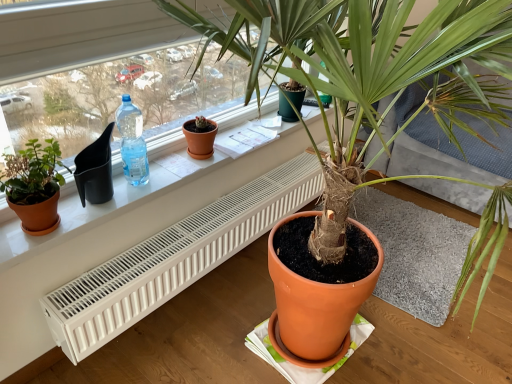
Question: Is the surface of matte terracotta pot at left, placed as the 2th houseplant when sorted from front to back, in direct contact with translucent plastic bottle at window left?

Choices:
 (A) yes
 (B) no

Answer: (B)

Question: From a real-world perspective, does matte terracotta pot at left, the first houseplant in the back-to-front sequence, stand above translucent plastic bottle at window left?

Choices:
 (A) yes
 (B) no

Answer: (B)

Question: Can you confirm if matte terracotta pot at left, placed as the 2th houseplant when sorted from front to back, is bigger than translucent plastic bottle at window left?

Choices:
 (A) no
 (B) yes

Answer: (B)

Question: From a real-world perspective, is matte terracotta pot at left, placed as the 2th houseplant when sorted from front to back, beneath translucent plastic bottle at window left?

Choices:
 (A) yes
 (B) no

Answer: (A)

Question: Would you say matte terracotta pot at left, which is the 2th houseplant in right-to-left order, contains translucent plastic bottle at window left?

Choices:
 (A) yes
 (B) no

Answer: (B)

Question: Can you confirm if matte terracotta pot at left, placed as the 2th houseplant when sorted from front to back, is taller than translucent plastic bottle at window left?

Choices:
 (A) yes
 (B) no

Answer: (B)

Question: Is white plastic radiator at lower center at the back of matte orange pot at center, the 2th houseplant when ordered from left to right?

Choices:
 (A) no
 (B) yes

Answer: (B)

Question: Does matte orange pot at center, marked as the 2th houseplant in a back-to-front arrangement, lie behind white plastic radiator at lower center?

Choices:
 (A) yes
 (B) no

Answer: (B)

Question: Can you see matte orange pot at center, which is the first houseplant in right-to-left order, touching white plastic radiator at lower center?

Choices:
 (A) no
 (B) yes

Answer: (A)

Question: From the image's perspective, is matte orange pot at center, marked as the 2th houseplant in a back-to-front arrangement, on top of white plastic radiator at lower center?

Choices:
 (A) no
 (B) yes

Answer: (B)

Question: Is matte orange pot at center, the 1th houseplant when ordered from front to back, to the right of white plastic radiator at lower center from the viewer's perspective?

Choices:
 (A) no
 (B) yes

Answer: (B)

Question: Does matte orange pot at center, the 2th houseplant when ordered from left to right, have a larger size compared to white plastic radiator at lower center?

Choices:
 (A) yes
 (B) no

Answer: (A)

Question: Is white plastic radiator at lower center positioned with its back to translucent plastic bottle at window left?

Choices:
 (A) no
 (B) yes

Answer: (A)